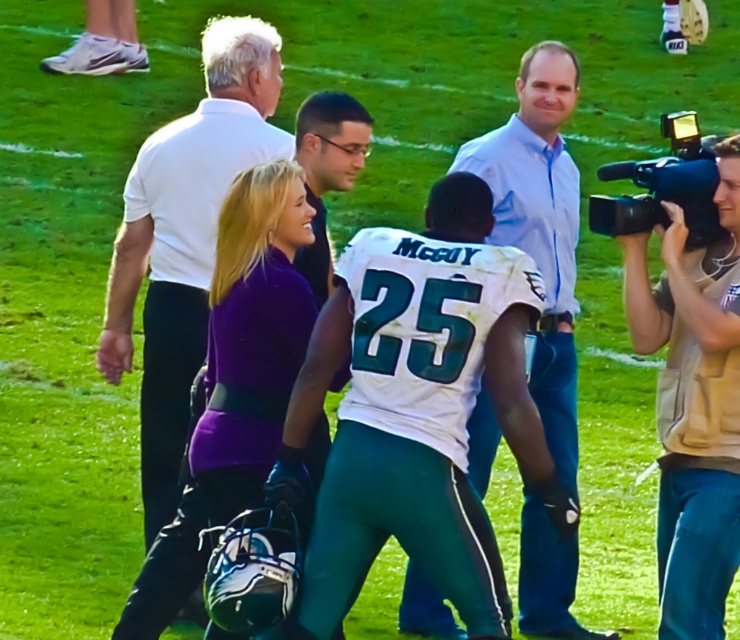
You are a photographer trying to set up your equipment on the field. You have a beige fabric camera at right and a black plastic video camera at right. Which camera is placed lower in your setup?

Result: The beige fabric camera at right is positioned under the black plastic video camera at right, so it is placed lower in the setup.

You are a photographer trying to capture a candid shot of the light blue shirt at center. You have a beige fabric camera at right. Considering their heights, will the camera be able to fit into the frame without any obstruction?

The beige fabric camera at right is shorter than the light blue shirt at center, so the camera can fit into the frame without obstruction as it is shorter than the subject.